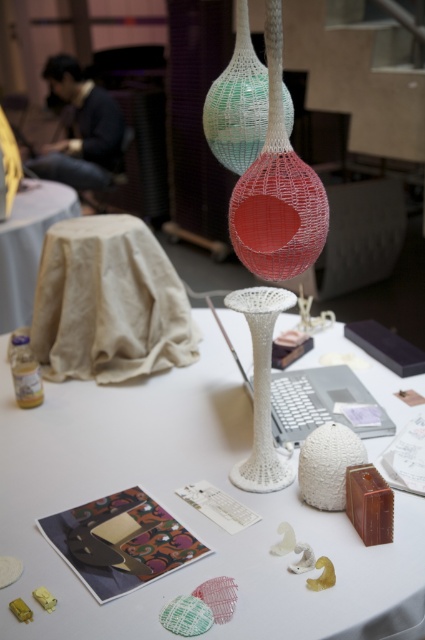
Question: Considering the relative positions of translucent mesh vase at center and beige fabric-covered table at center in the image provided, where is translucent mesh vase at center located with respect to beige fabric-covered table at center?

Choices:
 (A) right
 (B) left

Answer: (A)

Question: Observing the image, what is the correct spatial positioning of white mesh vase at upper center in reference to beige fabric-covered table at center?

Choices:
 (A) below
 (B) above

Answer: (A)

Question: Which of the following is the closest to the observer?

Choices:
 (A) white mesh vase at upper center
 (B) translucent mesh vase at center
 (C) beige fabric-covered table at center

Answer: (A)

Question: Where is beige fabric-covered stool at center-left located in relation to white mesh vase at upper center in the image?

Choices:
 (A) right
 (B) left

Answer: (B)

Question: Which of the following is the farthest from the observer?

Choices:
 (A) white matte vase at center
 (B) white mesh vase at center
 (C) beige fabric-covered stool at center-left

Answer: (C)

Question: Which of the following is the farthest from the observer?

Choices:
 (A) (153, 282)
 (B) (170, 577)
 (C) (240, 472)

Answer: (A)